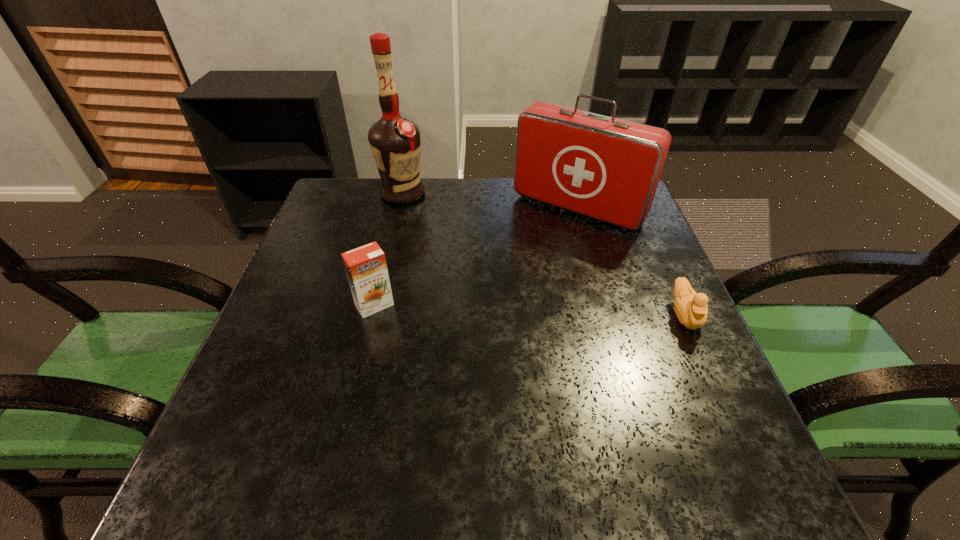
You are a GUI agent. You are given a task and a screenshot of the screen. Output one action in this format:
    pyautogui.click(x=<x>, y=<y>)
    Task: Click on the free spot located on the side of the first-aid kit with the first aid cross symbol
    
    Given the screenshot: What is the action you would take?
    pyautogui.click(x=531, y=255)

In order to click on blank area located on the side of the first-aid kit with the first aid cross symbol in this screenshot , I will do `click(502, 292)`.

At what (x,y) coordinates should I click in order to perform the action: click on liquor present at the far edge. Please return your answer as a coordinate pair (x, y). Looking at the image, I should click on (395, 143).

The width and height of the screenshot is (960, 540). Identify the location of the first-aid kit that is at the far edge. (602, 167).

Locate an element on the screen. object that is positioned at the left edge is located at coordinates (395, 143).

Where is `duckling located in the right edge section of the desktop`? The height and width of the screenshot is (540, 960). duckling located in the right edge section of the desktop is located at coordinates (690, 307).

Find the location of a particular element. The height and width of the screenshot is (540, 960). the first-aid kit positioned at the right edge is located at coordinates (602, 167).

At what (x,y) coordinates should I click in order to perform the action: click on object located in the far left corner section of the desktop. Please return your answer as a coordinate pair (x, y). The height and width of the screenshot is (540, 960). Looking at the image, I should click on (395, 143).

The image size is (960, 540). I want to click on object situated at the far right corner, so click(x=602, y=167).

The width and height of the screenshot is (960, 540). In the image, there is a desktop. Find the location of `blank space at the far edge`. blank space at the far edge is located at coordinates (576, 215).